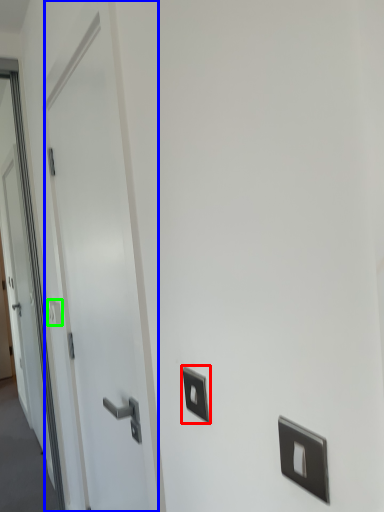
Question: Which is nearer to the light switch (highlighted by a red box)? door (highlighted by a blue box) or light switch (highlighted by a green box).

Choices:
 (A) door
 (B) light switch

Answer: (A)